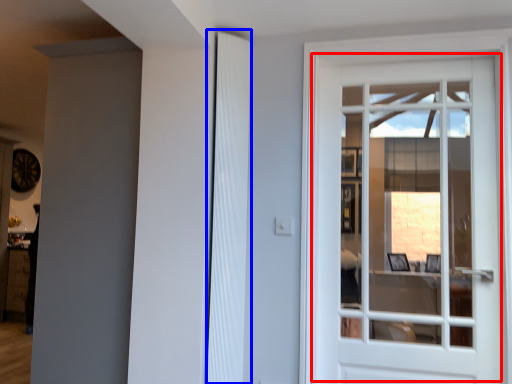
Question: Among these objects, which one is nearest to the camera, door (highlighted by a red box) or shutter (highlighted by a blue box)?

Choices:
 (A) door
 (B) shutter

Answer: (A)